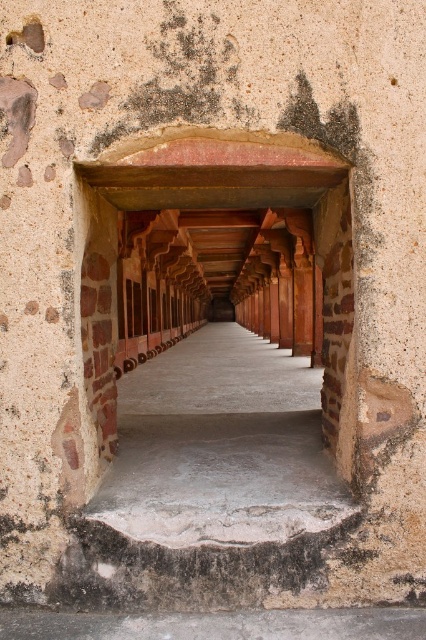
Does smooth concrete corridor at center appear over rusty metal hole at upper left?

Incorrect, smooth concrete corridor at center is not positioned above rusty metal hole at upper left.

I want to click on smooth concrete corridor at center, so click(221, 445).

Locate an element on the screen. The width and height of the screenshot is (426, 640). smooth concrete corridor at center is located at coordinates (221, 445).